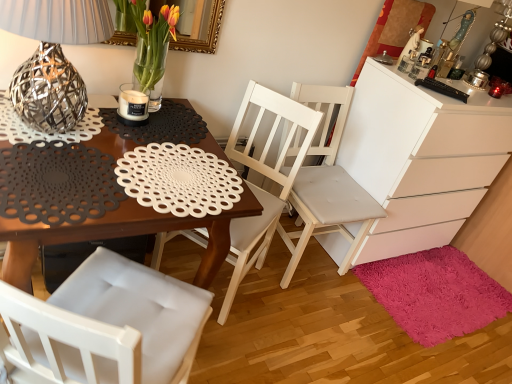
Find the location of a particular element. shaggy pink rug at lower right is located at coordinates (435, 293).

Describe the element at coordinates (421, 157) in the screenshot. I see `white matte chest of drawers at right` at that location.

From the picture: Measure the distance between point (372, 259) and camera.

Point (372, 259) is 7.47 feet away from camera.

The height and width of the screenshot is (384, 512). What are the coordinates of `white wood chair at center, the 1th chair viewed from the left` in the screenshot? It's located at (265, 176).

Describe the element at coordinates (116, 236) in the screenshot. This screenshot has height=384, width=512. I see `matte black placemat at center` at that location.

Image resolution: width=512 pixels, height=384 pixels. Describe the element at coordinates (132, 106) in the screenshot. I see `white matte candle at table` at that location.

Locate an element on the screen. The height and width of the screenshot is (384, 512). white matte candle at table is located at coordinates (132, 106).

In order to click on shaggy pink rug at lower right in this screenshot , I will do `click(435, 293)`.

Is metallic wire ball at left oriented towards matte black placemat at center?

No, metallic wire ball at left is not aimed at matte black placemat at center.

Would you say metallic wire ball at left contains matte black placemat at center?

No, matte black placemat at center is not inside metallic wire ball at left.

How different are the orientations of metallic wire ball at left and matte black placemat at center in degrees?

metallic wire ball at left and matte black placemat at center are facing 1.01 degrees away from each other.

This screenshot has width=512, height=384. I want to click on table lamp on the left side of matte black placemat at center, so click(53, 58).

From the image's perspective, which one is positioned lower, white wood chair at center, the 1th chair from the right, or white wood chair at center, which is counted as the 2th chair, starting from the right?

white wood chair at center, which is counted as the 2th chair, starting from the right, is shown below in the image.

Consider the image. Is there a large distance between white wood chair at center, arranged as the second chair when viewed from the left, and white wood chair at center, which is counted as the 2th chair, starting from the right?

Actually, white wood chair at center, arranged as the second chair when viewed from the left, and white wood chair at center, which is counted as the 2th chair, starting from the right, are a little close together.

In the scene shown: Considering the sizes of objects white wood chair at center, arranged as the second chair when viewed from the left, and white wood chair at center, the 1th chair viewed from the left, in the image provided, who is thinner, white wood chair at center, arranged as the second chair when viewed from the left, or white wood chair at center, the 1th chair viewed from the left,?

white wood chair at center, arranged as the second chair when viewed from the left, is thinner.

Could you tell me if white wood chair at center, arranged as the second chair when viewed from the left, is turned towards white wood chair at center, the 1th chair viewed from the left?

No, white wood chair at center, arranged as the second chair when viewed from the left, is not turned towards white wood chair at center, the 1th chair viewed from the left.

From the picture: From a real-world perspective, who is located higher, matte glass vase with tulips at upper center or matte black placemat at center?

matte glass vase with tulips at upper center is physically above.

From the image's perspective, does matte glass vase with tulips at upper center appear lower than matte black placemat at center?

No, from the image's perspective, matte glass vase with tulips at upper center is not below matte black placemat at center.

Is matte glass vase with tulips at upper center positioned before matte black placemat at center?

No, matte glass vase with tulips at upper center is behind matte black placemat at center.

In terms of height, does matte glass vase with tulips at upper center look taller or shorter compared to matte black placemat at center?

matte glass vase with tulips at upper center is shorter than matte black placemat at center.

From a real-world perspective, is shaggy pink rug at lower right physically located above or below metallic wire ball at left?

shaggy pink rug at lower right is situated lower than metallic wire ball at left in the real world.

From the image's perspective, is shaggy pink rug at lower right located above metallic wire ball at left?

Actually, shaggy pink rug at lower right appears below metallic wire ball at left in the image.

Which of these two, shaggy pink rug at lower right or metallic wire ball at left, is thinner?

Thinner between the two is metallic wire ball at left.

Based on the photo, considering the positions of objects shaggy pink rug at lower right and metallic wire ball at left in the image provided, who is more to the right, shaggy pink rug at lower right or metallic wire ball at left?

Positioned to the right is shaggy pink rug at lower right.

From the image's perspective, does matte glass vase with tulips at upper center appear lower than white wood chair at center, the 1th chair from the right?

Incorrect, from the image's perspective, matte glass vase with tulips at upper center is higher than white wood chair at center, the 1th chair from the right.

Which object is closer to the camera taking this photo, matte glass vase with tulips at upper center or white wood chair at center, arranged as the second chair when viewed from the left?

matte glass vase with tulips at upper center is closer to the camera.

Could you measure the distance between matte glass vase with tulips at upper center and white wood chair at center, arranged as the second chair when viewed from the left?

matte glass vase with tulips at upper center is 83.52 centimeters from white wood chair at center, arranged as the second chair when viewed from the left.

Considering the sizes of matte glass vase with tulips at upper center and white wood chair at center, the 1th chair from the right, in the image, is matte glass vase with tulips at upper center wider or thinner than white wood chair at center, the 1th chair from the right,?

In the image, matte glass vase with tulips at upper center appears to be more narrow than white wood chair at center, the 1th chair from the right.

In terms of width, does metallic wire ball at left look wider or thinner when compared to white wood chair at center, which is counted as the 2th chair, starting from the right?

Clearly, metallic wire ball at left has less width compared to white wood chair at center, which is counted as the 2th chair, starting from the right.

From the picture: From the image's perspective, which is above, metallic wire ball at left or white wood chair at center, the 1th chair viewed from the left?

From the image's view, metallic wire ball at left is above.

Is metallic wire ball at left looking in the opposite direction of white wood chair at center, which is counted as the 2th chair, starting from the right?

That's not correct — metallic wire ball at left is not looking away from white wood chair at center, which is counted as the 2th chair, starting from the right.

Is metallic wire ball at left smaller than white wood chair at center, which is counted as the 2th chair, starting from the right?

Yes, metallic wire ball at left is smaller than white wood chair at center, which is counted as the 2th chair, starting from the right.

Is white wood chair at center, which is counted as the 2th chair, starting from the right, not within shaggy pink rug at lower right?

Yes.

In the scene shown: Considering the positions of objects white wood chair at center, the 1th chair viewed from the left, and shaggy pink rug at lower right in the image provided, who is more to the left, white wood chair at center, the 1th chair viewed from the left, or shaggy pink rug at lower right?

white wood chair at center, the 1th chair viewed from the left.

Is white wood chair at center, the 1th chair viewed from the left, aimed at shaggy pink rug at lower right?

No.

From the image's perspective, is white wood chair at center, which is counted as the 2th chair, starting from the right, beneath shaggy pink rug at lower right?

Incorrect, from the image's perspective, white wood chair at center, which is counted as the 2th chair, starting from the right, is higher than shaggy pink rug at lower right.

Image resolution: width=512 pixels, height=384 pixels. I want to click on table lamp located above the matte black placemat at center (from the image's perspective), so click(x=53, y=58).

What are the coordinates of `chair that is below the white wood chair at center, arranged as the second chair when viewed from the left (from the image's perspective)` in the screenshot? It's located at (265, 176).

From the image, which object appears to be nearer to metallic wire ball at left, white wood chair at center, the 1th chair viewed from the left, or white matte candle at table?

white matte candle at table is positioned closer to the anchor metallic wire ball at left.

When comparing their distances from white matte candle at table, does shaggy pink rug at lower right or metallic wire ball at left seem closer?

The object closer to white matte candle at table is metallic wire ball at left.

In the scene shown: When comparing their distances from shaggy pink rug at lower right, does matte glass vase with tulips at upper center or metallic wire ball at left seem further?

metallic wire ball at left is further to shaggy pink rug at lower right.

From the image, which object appears to be farther from white wood chair at center, arranged as the second chair when viewed from the left, matte glass vase with tulips at upper center or metallic wire ball at left?

Among the two, metallic wire ball at left is located further to white wood chair at center, arranged as the second chair when viewed from the left.

In the scene shown: Looking at the image, which one is located closer to metallic wire ball at left, matte glass vase with tulips at upper center or shaggy pink rug at lower right?

The object closer to metallic wire ball at left is matte glass vase with tulips at upper center.

Looking at the image, which one is located further to white wood chair at center, arranged as the second chair when viewed from the left, white matte candle at table or shaggy pink rug at lower right?

Based on the image, white matte candle at table appears to be further to white wood chair at center, arranged as the second chair when viewed from the left.

Based on their spatial positions, is white wood chair at center, the 1th chair viewed from the left, or white matte candle at table further from shaggy pink rug at lower right?

white matte candle at table.

In the scene shown: From the image, which object appears to be farther from white matte chest of drawers at right, white wood chair at center, which is counted as the 2th chair, starting from the right, or shaggy pink rug at lower right?

Among the two, white wood chair at center, which is counted as the 2th chair, starting from the right, is located further to white matte chest of drawers at right.

Where is `the chest of drawers situated between matte glass vase with tulips at upper center and shaggy pink rug at lower right from left to right`? Image resolution: width=512 pixels, height=384 pixels. the chest of drawers situated between matte glass vase with tulips at upper center and shaggy pink rug at lower right from left to right is located at coordinates (421, 157).

You are a GUI agent. You are given a task and a screenshot of the screen. Output one action in this format:
    pyautogui.click(x=<x>, y=<y>)
    Task: Click on the chair located between matte glass vase with tulips at upper center and white wood chair at center, the 1th chair from the right, in the left-right direction
    
    Given the screenshot: What is the action you would take?
    pyautogui.click(x=265, y=176)

Locate an element on the screen. candle holder situated between matte black placemat at center and shaggy pink rug at lower right from left to right is located at coordinates (132, 106).

What are the coordinates of `floral arrangement located between metallic wire ball at left and shaggy pink rug at lower right in the left-right direction` in the screenshot? It's located at (152, 46).